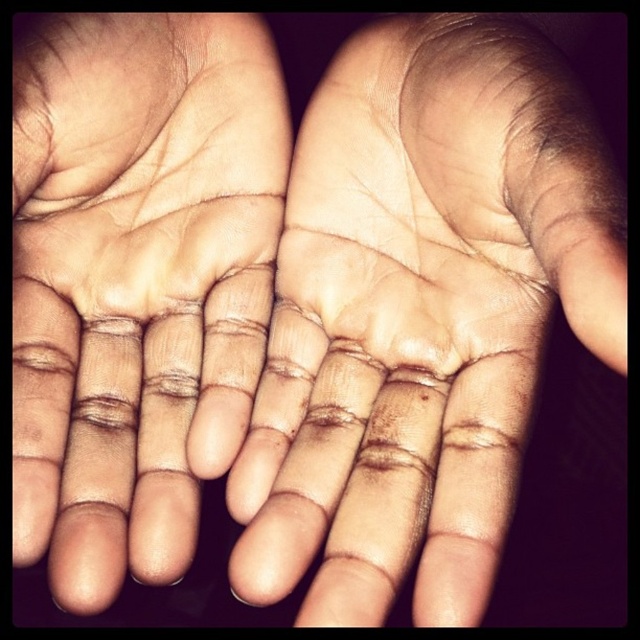
You are a dermatologist examining two palms in an image. You notice that the light skin tone palm at center and the dry skin palm at center are positioned side by side. Which palm has a larger surface area?

The light skin tone palm at center is larger in size than the dry skin palm at center, so it has a larger surface area.

You are a photographer trying to capture a closeup of the light skin tone palm at center. Your camera lens has a minimum focusing distance of 16 inches. Can you take the photo without moving the palm?

The light skin tone palm at center and viewer are 16.30 inches apart from each other, so the distance is just slightly beyond the camera lens minimum focusing distance of 16 inches. Therefore, you cannot take the photo without moving the palm closer.

Consider the image. You are a dermatologist examining two palms in an image. You notice the light skin tone palm at center and the dry skin palm at center. Which palm has a greater width?

The light skin tone palm at center has a greater width than the dry skin palm at center according to the description.